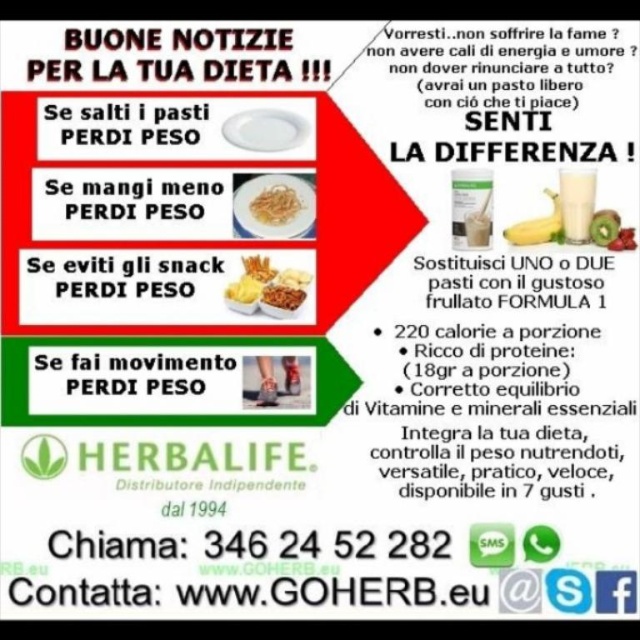
Question: Which of the following is the farthest from the observer?

Choices:
 (A) green matte kiwi at center
 (B) white creamy milkshake at right
 (C) shiny plastic snacks at center

Answer: (C)

Question: Can you confirm if white creamy milkshake at right is smaller than green matte kiwi at center?

Choices:
 (A) yes
 (B) no

Answer: (B)

Question: Estimate the real-world distances between objects in this image. Which object is closer to the shiny plastic snacks at center?

Choices:
 (A) shiny silver fork at upper center
 (B) yellow crispy snack at center

Answer: (A)

Question: Which of the following is the closest to the observer?

Choices:
 (A) green matte kiwi at center
 (B) yellow crispy snack at center
 (C) white creamy milkshake at right

Answer: (C)

Question: Observing the image, what is the correct spatial positioning of yellow crumbly snack at center in reference to green matte kiwi at center?

Choices:
 (A) below
 (B) above

Answer: (A)

Question: Where is white creamy milkshake at right located in relation to yellow crumbly snack at center in the image?

Choices:
 (A) right
 (B) left

Answer: (A)